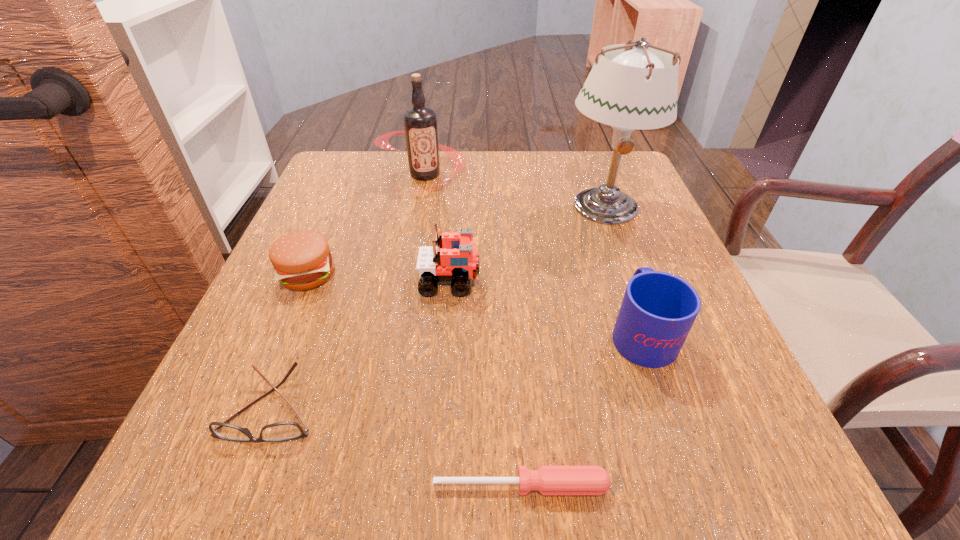
Where is `lampshade`? lampshade is located at coordinates (637, 89).

This screenshot has width=960, height=540. What are the coordinates of `the sixth shortest object` in the screenshot? It's located at (420, 124).

Locate an element on the screen. Lego is located at coordinates (458, 258).

Find the location of a particular element. The height and width of the screenshot is (540, 960). the fifth farthest object is located at coordinates (658, 310).

Locate an element on the screen. This screenshot has width=960, height=540. hamburger is located at coordinates (302, 260).

Image resolution: width=960 pixels, height=540 pixels. I want to click on spectacles, so click(x=281, y=431).

I want to click on the sixth farthest object, so click(281, 431).

This screenshot has width=960, height=540. In order to click on the shortest object in this screenshot , I will do `click(549, 480)`.

Locate an element on the screen. This screenshot has height=540, width=960. the nearest object is located at coordinates (549, 480).

Image resolution: width=960 pixels, height=540 pixels. I want to click on free space located on the lampshade of the lampshade, so click(644, 318).